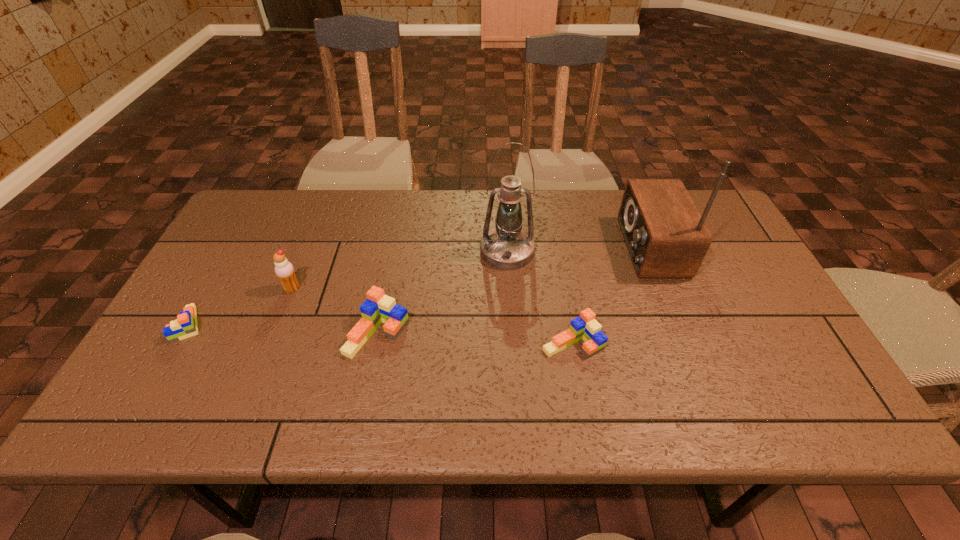
Please point a free position for a Lego on the right. Please provide its 2D coordinates. Your answer should be formatted as a tuple, i.e. [(x, y)], where the tuple contains the x and y coordinates of a point satisfying the conditions above.

[(775, 353)]